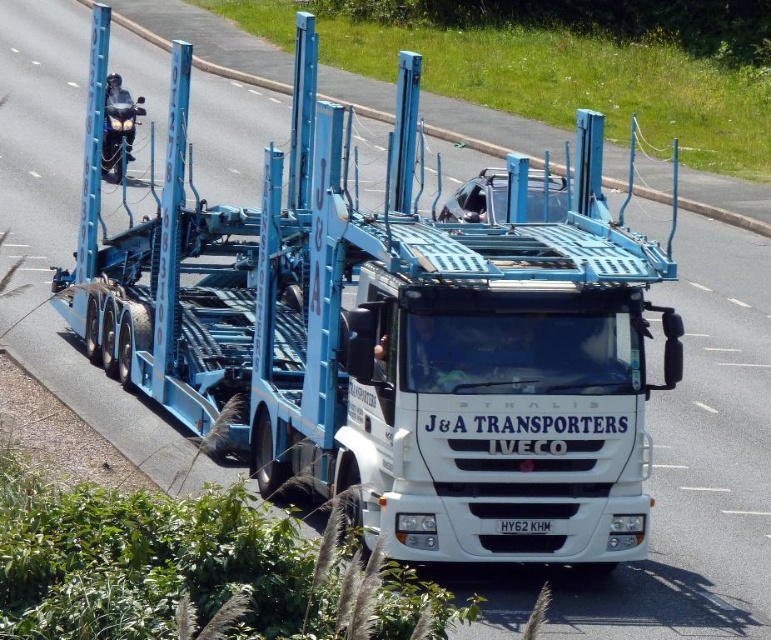
Is white matte trailer truck at center positioned before shiny chrome motorcycle at left?

Yes, it is.

Who is taller, white matte trailer truck at center or shiny chrome motorcycle at left?

Standing taller between the two is white matte trailer truck at center.

Where is `white matte trailer truck at center`? This screenshot has height=640, width=771. white matte trailer truck at center is located at coordinates (389, 337).

I want to click on white matte trailer truck at center, so click(x=389, y=337).